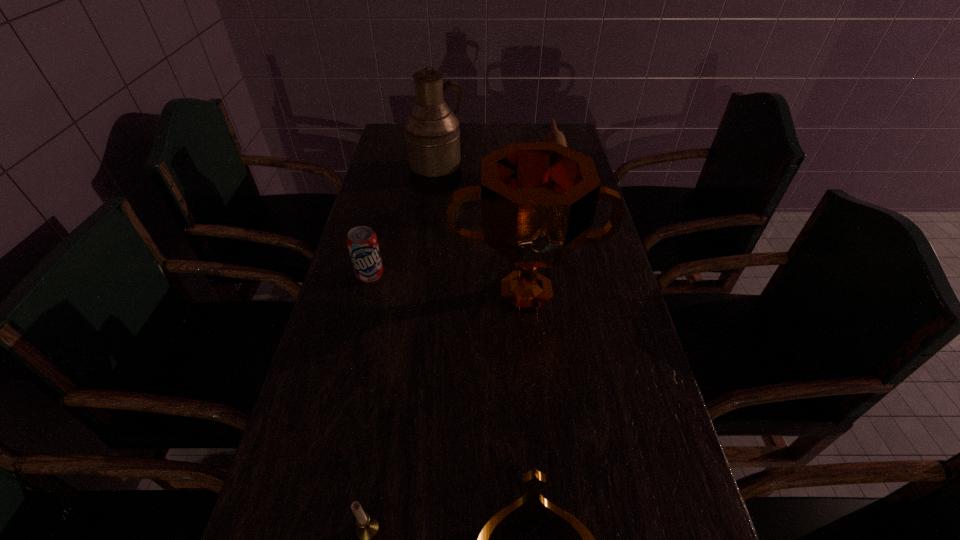
You are a GUI agent. You are given a task and a screenshot of the screen. Output one action in this format:
    pyautogui.click(x=<x>, y=<y>)
    Task: Click on the free space that satisfies the following two spatial constraints: 1. on the left side of the fourth shortest object; 2. on the side of the award with the star emblem
    This screenshot has width=960, height=540.
    Given the screenshot: What is the action you would take?
    pyautogui.click(x=576, y=293)

Locate an element on the screen. The height and width of the screenshot is (540, 960). blank area in the image that satisfies the following two spatial constraints: 1. on the left side of the puppy; 2. on the side of the award with the star emblem is located at coordinates (576, 293).